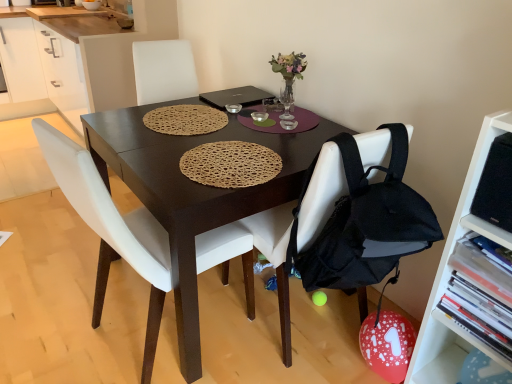
Question: Which is correct: white plastic shelf at right is inside black matte laptop at center, or outside of it?

Choices:
 (A) inside
 (B) outside

Answer: (B)

Question: Is point (414, 367) closer or farther from the camera than point (207, 94)?

Choices:
 (A) closer
 (B) farther

Answer: (A)

Question: Which object is positioned closest to the black matte laptop at center?

Choices:
 (A) woven brown placemat at center
 (B) dark wood table at center
 (C) white fabric chair at center, which ranks as the first chair in right-to-left order
 (D) white matte cabinet at upper left
 (E) white leather chair at center, positioned as the second chair in right-to-left order

Answer: (A)

Question: Which of these objects is positioned farthest from the dark wood table at center?

Choices:
 (A) black matte laptop at center
 (B) white fabric chair at center, which ranks as the first chair in right-to-left order
 (C) white plastic shelf at right
 (D) woven brown placemat at center
 (E) white leather chair at center, arranged as the 1th chair when viewed from the left

Answer: (C)